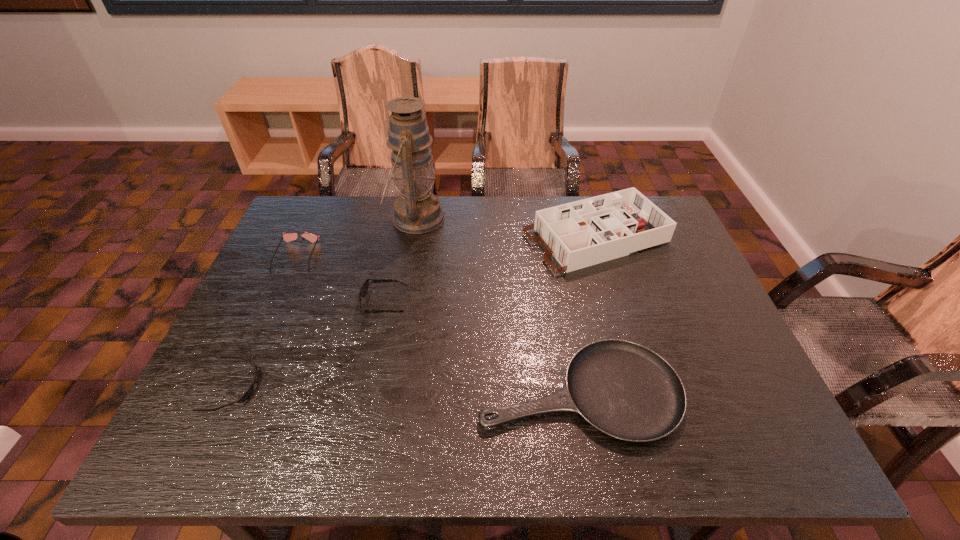
Image resolution: width=960 pixels, height=540 pixels. I want to click on vacant space at the far edge of the desktop, so click(496, 242).

At what (x,y) coordinates should I click in order to perform the action: click on free region at the left edge of the desktop. Please return your answer as a coordinate pair (x, y). The image size is (960, 540). Looking at the image, I should click on (266, 319).

I want to click on vacant region at the right edge of the desktop, so click(672, 244).

Image resolution: width=960 pixels, height=540 pixels. In the image, there is a desktop. Identify the location of vacant space at the near right corner. point(777,432).

The width and height of the screenshot is (960, 540). In order to click on unoccupied area between the dollhouse and the nearest sunglasses in this screenshot , I will do `click(415, 313)`.

Image resolution: width=960 pixels, height=540 pixels. In order to click on free space between the oil lamp and the rightmost sunglasses in this screenshot , I will do `click(400, 261)`.

Identify the location of vacant space that is in between the frying pan and the nearest sunglasses. (407, 389).

Image resolution: width=960 pixels, height=540 pixels. I want to click on free space between the shortest sunglasses and the oil lamp, so click(x=324, y=302).

Locate an element on the screen. vacant region between the shortest sunglasses and the farthest sunglasses is located at coordinates (265, 321).

Identify the location of free area in between the oil lamp and the shortest sunglasses. click(324, 302).